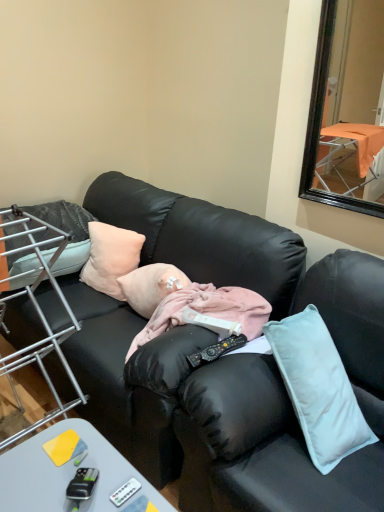
Question: Is peach fabric pillow at center, which appears as the 2th pillow when viewed from the left, at the left side of white plastic remote control at lower center, which is the second remote control from back to front?

Choices:
 (A) yes
 (B) no

Answer: (A)

Question: From the image's perspective, does peach fabric pillow at center, which appears as the 2th pillow when viewed from the left, appear higher than white plastic remote control at lower center, which is the second remote control from back to front?

Choices:
 (A) no
 (B) yes

Answer: (B)

Question: Does peach fabric pillow at center, which appears as the 1th pillow when viewed from the right, have a larger size compared to white plastic remote control at lower center, arranged as the second remote control when viewed from the right?

Choices:
 (A) no
 (B) yes

Answer: (B)

Question: From a real-world perspective, is peach fabric pillow at center, which appears as the 1th pillow when viewed from the right, positioned over white plastic remote control at lower center, arranged as the second remote control when viewed from the right, based on gravity?

Choices:
 (A) no
 (B) yes

Answer: (B)

Question: From a real-world perspective, is peach fabric pillow at center, which appears as the 1th pillow when viewed from the right, under white plastic remote control at lower center, the 1th remote control when ordered from bottom to top?

Choices:
 (A) yes
 (B) no

Answer: (B)

Question: Considering the relative sizes of peach fabric pillow at center, which appears as the 1th pillow when viewed from the right, and white plastic remote control at lower center, arranged as the 1th remote control when viewed from the front, in the image provided, is peach fabric pillow at center, which appears as the 1th pillow when viewed from the right, wider than white plastic remote control at lower center, arranged as the 1th remote control when viewed from the front,?

Choices:
 (A) no
 (B) yes

Answer: (B)

Question: Does gray plastic desk at lower left appear on the left side of black leather couch at center?

Choices:
 (A) yes
 (B) no

Answer: (B)

Question: From a real-world perspective, is gray plastic desk at lower left beneath black leather couch at center?

Choices:
 (A) no
 (B) yes

Answer: (B)

Question: Is gray plastic desk at lower left completely or partially outside of black leather couch at center?

Choices:
 (A) no
 (B) yes

Answer: (B)

Question: Is gray plastic desk at lower left bigger than black leather couch at center?

Choices:
 (A) yes
 (B) no

Answer: (B)

Question: Does gray plastic desk at lower left appear on the right side of black leather couch at center?

Choices:
 (A) no
 (B) yes

Answer: (B)

Question: Is black leather couch at center located within gray plastic desk at lower left?

Choices:
 (A) no
 (B) yes

Answer: (A)

Question: From the image's perspective, is black plastic remote control at center, which is the first remote control from right to left, on top of soft pink pillow at left, arranged as the first pillow when viewed from the left?

Choices:
 (A) yes
 (B) no

Answer: (B)